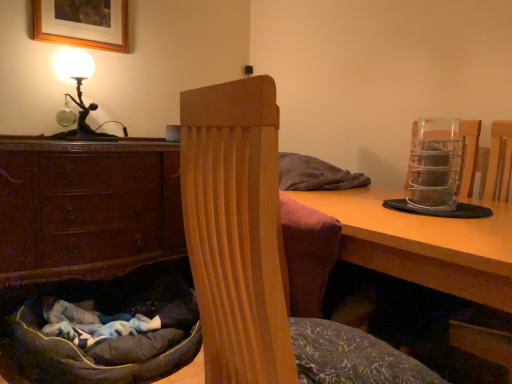
Question: Can we say brown wood chest of drawers at lower left lies outside metallic wire mesh at right?

Choices:
 (A) yes
 (B) no

Answer: (A)

Question: Is brown wood chest of drawers at lower left closer to the viewer compared to metallic wire mesh at right?

Choices:
 (A) yes
 (B) no

Answer: (B)

Question: From a real-world perspective, is brown wood chest of drawers at lower left on top of metallic wire mesh at right?

Choices:
 (A) yes
 (B) no

Answer: (B)

Question: Does brown wood chest of drawers at lower left have a greater height compared to metallic wire mesh at right?

Choices:
 (A) yes
 (B) no

Answer: (A)

Question: Can you confirm if brown wood chest of drawers at lower left is bigger than metallic wire mesh at right?

Choices:
 (A) yes
 (B) no

Answer: (A)

Question: Considering the positions of velvet-like brown bean bag chair at center, which is the first bean bag chair in front-to-back order, and brown wood chest of drawers at lower left in the image, is velvet-like brown bean bag chair at center, which is the first bean bag chair in front-to-back order, bigger or smaller than brown wood chest of drawers at lower left?

Choices:
 (A) small
 (B) big

Answer: (A)

Question: Which is correct: velvet-like brown bean bag chair at center, which is counted as the 1th bean bag chair, starting from the right, is inside brown wood chest of drawers at lower left, or outside of it?

Choices:
 (A) inside
 (B) outside

Answer: (B)

Question: Considering the positions of point tap(238, 359) and point tap(98, 216), is point tap(238, 359) closer or farther from the camera than point tap(98, 216)?

Choices:
 (A) closer
 (B) farther

Answer: (A)

Question: Is velvet-like brown bean bag chair at center, which ranks as the 2th bean bag chair in left-to-right order, to the left or to the right of brown wood chest of drawers at lower left in the image?

Choices:
 (A) left
 (B) right

Answer: (B)

Question: From a real-world perspective, is wooden picture frame at upper left physically located above or below dark gray plush bean bag chair at lower left, the second bean bag chair positioned from the front?

Choices:
 (A) below
 (B) above

Answer: (B)

Question: Is point (84, 1) closer or farther from the camera than point (39, 362)?

Choices:
 (A) closer
 (B) farther

Answer: (B)

Question: Is wooden picture frame at upper left bigger or smaller than dark gray plush bean bag chair at lower left, acting as the second bean bag chair starting from the right?

Choices:
 (A) small
 (B) big

Answer: (A)

Question: Is wooden picture frame at upper left wider or thinner than dark gray plush bean bag chair at lower left, which ranks as the first bean bag chair in back-to-front order?

Choices:
 (A) thin
 (B) wide

Answer: (A)

Question: From a real-world perspective, is metallic wire mesh at right positioned above or below wooden table at center?

Choices:
 (A) above
 (B) below

Answer: (A)

Question: In terms of height, does metallic wire mesh at right look taller or shorter compared to wooden table at center?

Choices:
 (A) tall
 (B) short

Answer: (B)